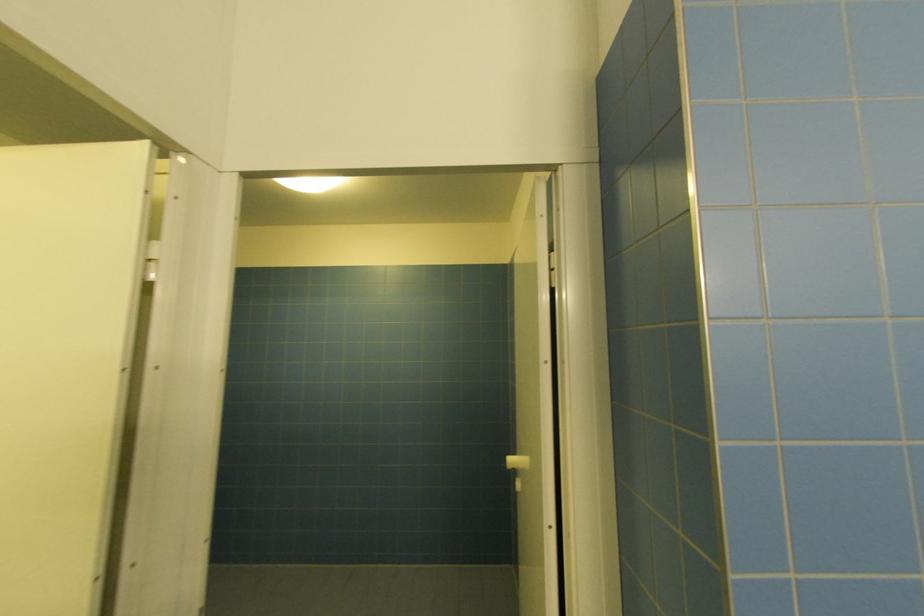
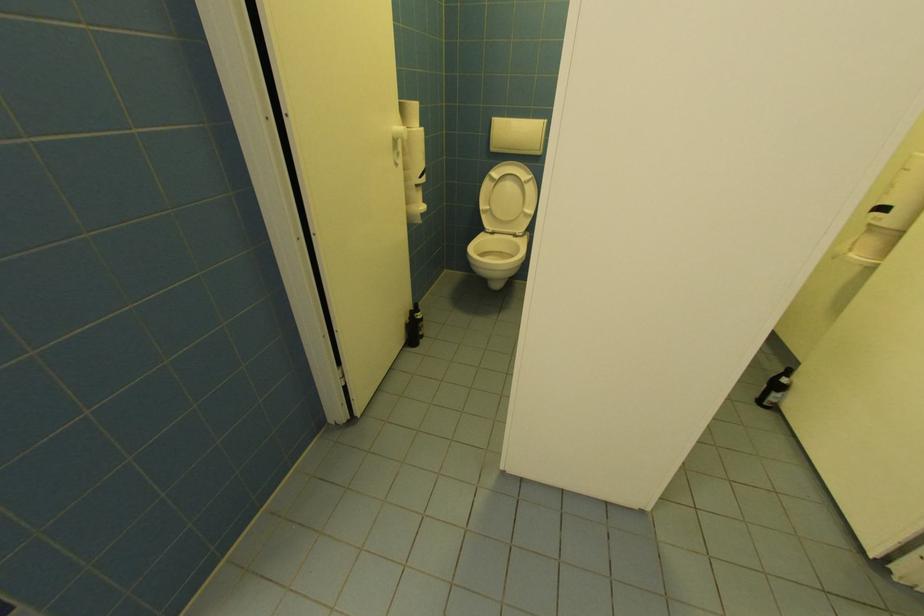
The first image is from the beginning of the video and the second image is from the end. How did the camera likely rotate when shooting the video?

The camera's rotation is toward left-down.